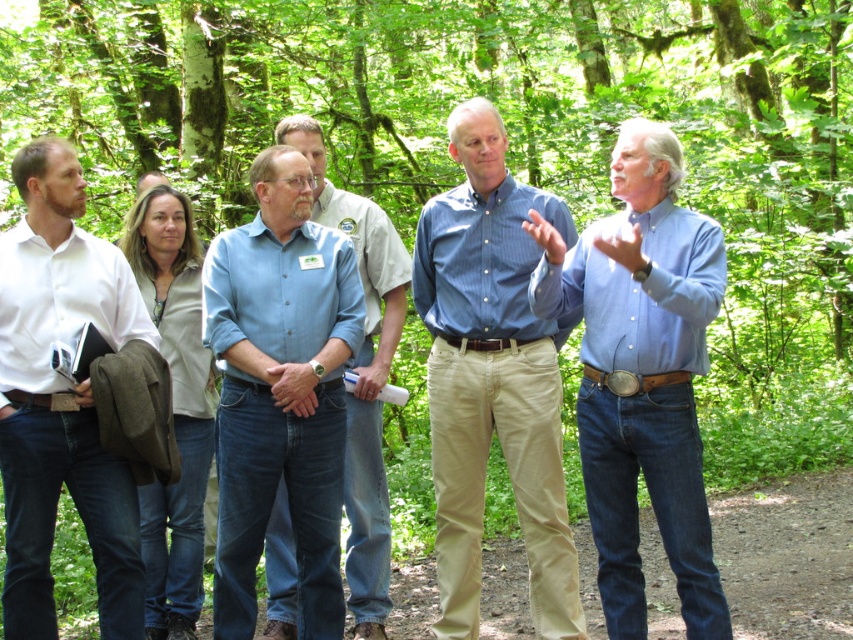
Which is above, blue cotton shirt at center or white shirt at left?

Positioned higher is white shirt at left.

Between point (227, 426) and point (27, 556), which one is positioned in front?

Positioned in front is point (27, 556).

You are a GUI agent. You are given a task and a screenshot of the screen. Output one action in this format:
    pyautogui.click(x=<x>, y=<y>)
    Task: Click on the blue cotton shirt at center
    
    Given the screenshot: What is the action you would take?
    pyautogui.click(x=280, y=392)

Can you confirm if blue striped shirt at center is positioned to the right of blue button-down shirt at center?

Correct, you'll find blue striped shirt at center to the right of blue button-down shirt at center.

Is point (462, 506) positioned before point (282, 508)?

Yes, it is.

What do you see at coordinates (492, 378) in the screenshot? I see `blue striped shirt at center` at bounding box center [492, 378].

This screenshot has width=853, height=640. Identify the location of blue striped shirt at center. (492, 378).

Is blue striped shirt at center in front of white shirt at left?

No, it is behind white shirt at left.

Describe the element at coordinates (492, 378) in the screenshot. The width and height of the screenshot is (853, 640). I see `blue striped shirt at center` at that location.

Does point (432, 296) come farther from viewer compared to point (33, 465)?

Yes, it is behind point (33, 465).

I want to click on blue striped shirt at center, so click(492, 378).